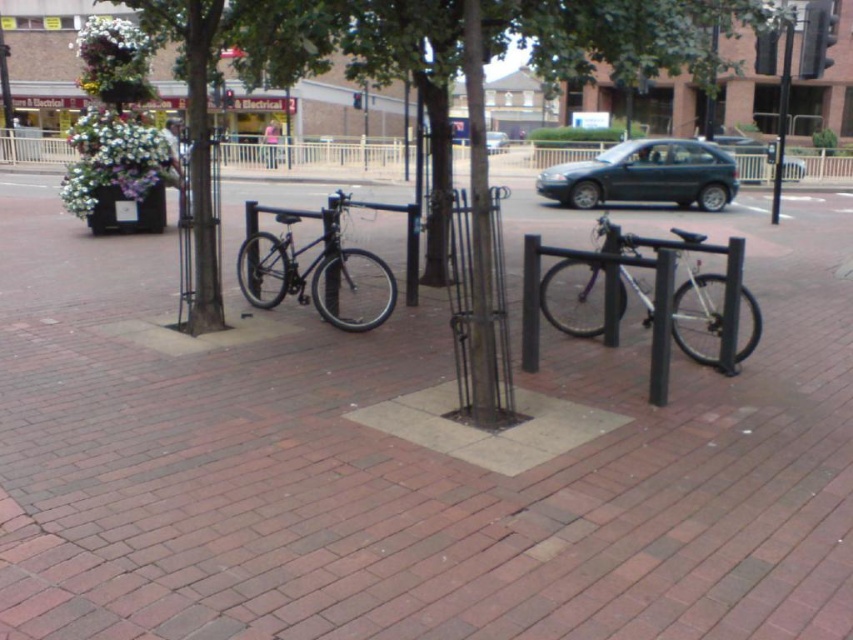
Is silver metallic bicycle at center right taller than black metal pole at upper right?

In fact, silver metallic bicycle at center right may be shorter than black metal pole at upper right.

Can you confirm if silver metallic bicycle at center right is smaller than black metal pole at upper right?

Correct, silver metallic bicycle at center right occupies less space than black metal pole at upper right.

This screenshot has width=853, height=640. I want to click on silver metallic bicycle at center right, so point(697,314).

What are the coordinates of `silver metallic bicycle at center right` in the screenshot? It's located at (697, 314).

Does black metal pole at center appear under dark green metallic car at center?

Indeed, black metal pole at center is positioned under dark green metallic car at center.

Does black metal pole at center appear on the right side of dark green metallic car at center?

In fact, black metal pole at center is to the left of dark green metallic car at center.

Is point (474, 408) farther from camera compared to point (741, 170)?

No, (474, 408) is in front of (741, 170).

Locate an element on the screen. This screenshot has width=853, height=640. black metal pole at center is located at coordinates (479, 232).

Who is more distant from viewer, [296,253] or [508,147]?

Point [508,147]

Who is taller, shiny black bicycle at center or metallic gray sedan at center?

Standing taller between the two is metallic gray sedan at center.

Does point (280, 300) come in front of point (496, 141)?

Yes, point (280, 300) is in front of point (496, 141).

Identify the location of shiny black bicycle at center. Image resolution: width=853 pixels, height=640 pixels. click(308, 268).